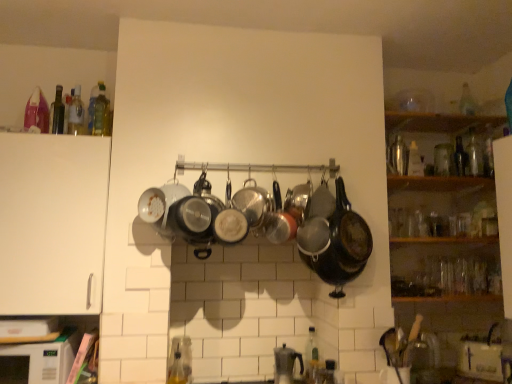
Question: Is shiny black wok at center aimed at translucent glass bottle at lower center, acting as the 9th bottle starting from the back?

Choices:
 (A) yes
 (B) no

Answer: (B)

Question: Does shiny black wok at center have a greater width compared to translucent glass bottle at lower center, which ranks as the first bottle in front-to-back order?

Choices:
 (A) no
 (B) yes

Answer: (B)

Question: From the image's perspective, is shiny black wok at center above translucent glass bottle at lower center, arranged as the 5th bottle when viewed from the left?

Choices:
 (A) yes
 (B) no

Answer: (A)

Question: Is shiny black wok at center looking in the opposite direction of translucent glass bottle at lower center, which ranks as the fifth bottle in right-to-left order?

Choices:
 (A) no
 (B) yes

Answer: (A)

Question: Are shiny black wok at center and translucent glass bottle at lower center, which ranks as the first bottle in front-to-back order, making contact?

Choices:
 (A) no
 (B) yes

Answer: (A)

Question: Can you confirm if shiny black wok at center is taller than translucent glass bottle at lower center, which ranks as the fifth bottle in right-to-left order?

Choices:
 (A) yes
 (B) no

Answer: (A)

Question: From a real-world perspective, is white matte cabinet at left under transparent glass bottle at upper right, acting as the 8th bottle starting from the front?

Choices:
 (A) yes
 (B) no

Answer: (A)

Question: Is white matte cabinet at left positioned with its back to transparent glass bottle at upper right, which appears as the 8th bottle when viewed from the left?

Choices:
 (A) yes
 (B) no

Answer: (B)

Question: Is the depth of white matte cabinet at left less than that of transparent glass bottle at upper right, which appears as the 8th bottle when viewed from the left?

Choices:
 (A) no
 (B) yes

Answer: (B)

Question: Does white matte cabinet at left have a greater height compared to transparent glass bottle at upper right, marked as the 2th bottle in a right-to-left arrangement?

Choices:
 (A) yes
 (B) no

Answer: (A)

Question: From the image's perspective, would you say white matte cabinet at left is positioned over transparent glass bottle at upper right, placed as the second bottle when sorted from back to front?

Choices:
 (A) yes
 (B) no

Answer: (B)

Question: Is white matte cabinet at left behind transparent glass bottle at upper right, marked as the 2th bottle in a right-to-left arrangement?

Choices:
 (A) no
 (B) yes

Answer: (A)

Question: From the image's perspective, does white matte cabinet at left appear lower than transparent glass bottle at upper right, the third bottle positioned from the right?

Choices:
 (A) yes
 (B) no

Answer: (A)